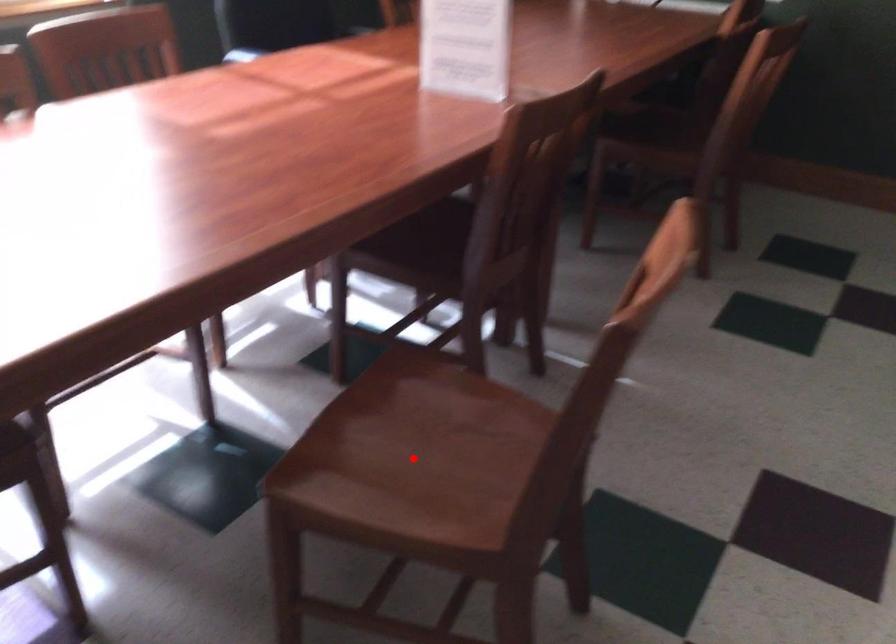
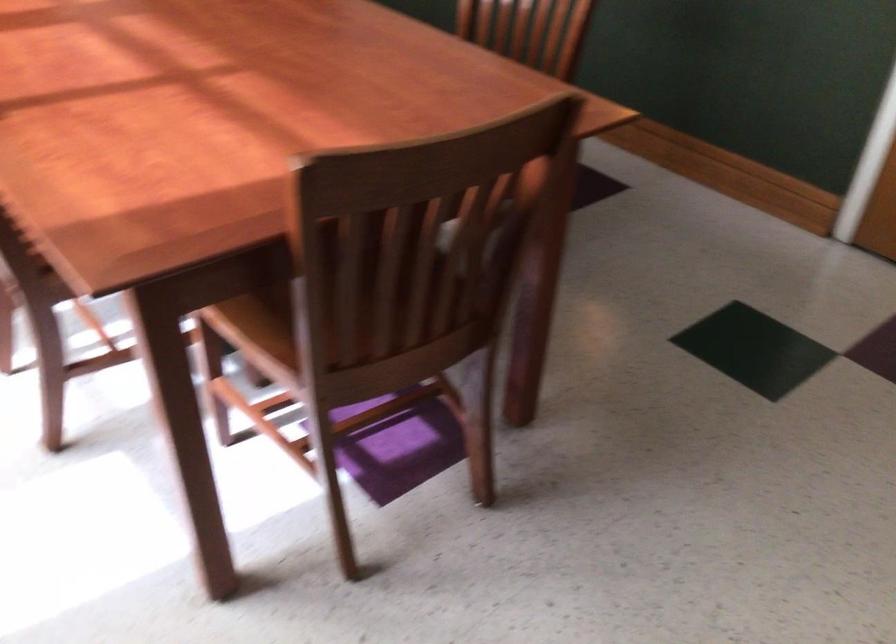
Question: I am providing you with two images of the same scene from different viewpoints. A red point is marked on the first image. Can you still see the location of the red point in image 2?

Choices:
 (A) Yes
 (B) No

Answer: (B)